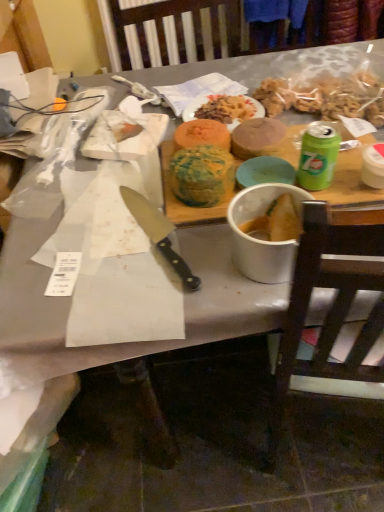
Question: From the image's perspective, relative to black plastic knife at center, is matte orange plate at center above or below?

Choices:
 (A) above
 (B) below

Answer: (A)

Question: In the image, is matte orange plate at center positioned in front of or behind black plastic knife at center?

Choices:
 (A) front
 (B) behind

Answer: (B)

Question: Based on their relative distances, which object is nearer to the smooth brown cake at center, the 1th food when ordered from right to left?

Choices:
 (A) brown wooden chair at right
 (B) black plastic knife at center
 (C) matte orange plate at center
 (D) green and yellow cake at center, placed as the 1th food when sorted from left to right
 (E) multicolored cake at center, the 2th food in the right-to-left sequence

Answer: (E)

Question: Estimate the real-world distances between objects in this image. Which object is farther from the multicolored cake at center, placed as the second food when sorted from left to right?

Choices:
 (A) matte orange plate at center
 (B) green and yellow cake at center, the third food viewed from the right
 (C) smooth brown cake at center, the 1th food when ordered from right to left
 (D) black plastic knife at center
 (E) brown wooden chair at right

Answer: (E)